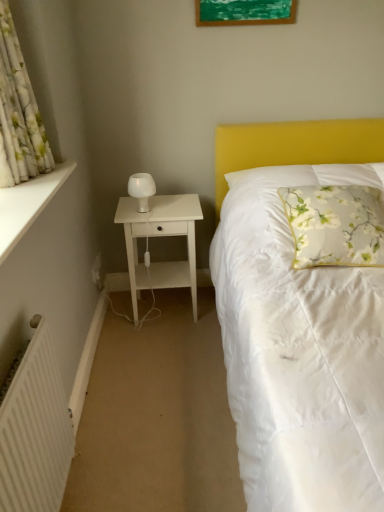
Question: Looking at the image, does white matte radiator at lower left seem bigger or smaller compared to white matte nightstand at left?

Choices:
 (A) small
 (B) big

Answer: (A)

Question: Considering their positions, is white matte radiator at lower left located in front of or behind white matte nightstand at left?

Choices:
 (A) behind
 (B) front

Answer: (B)

Question: Estimate the real-world distances between objects in this image. Which object is closer to the white matte nightstand at left?

Choices:
 (A) white floral fabric curtain at left
 (B) floral fabric pillow at center
 (C) green matte picture frame at upper center
 (D) white frosted glass lamp at left
 (E) white matte radiator at lower left

Answer: (D)

Question: Which object is positioned farthest from the floral fabric pillow at center?

Choices:
 (A) white matte nightstand at left
 (B) green matte picture frame at upper center
 (C) white painted wood at left
 (D) white floral fabric curtain at left
 (E) white matte radiator at lower left

Answer: (D)